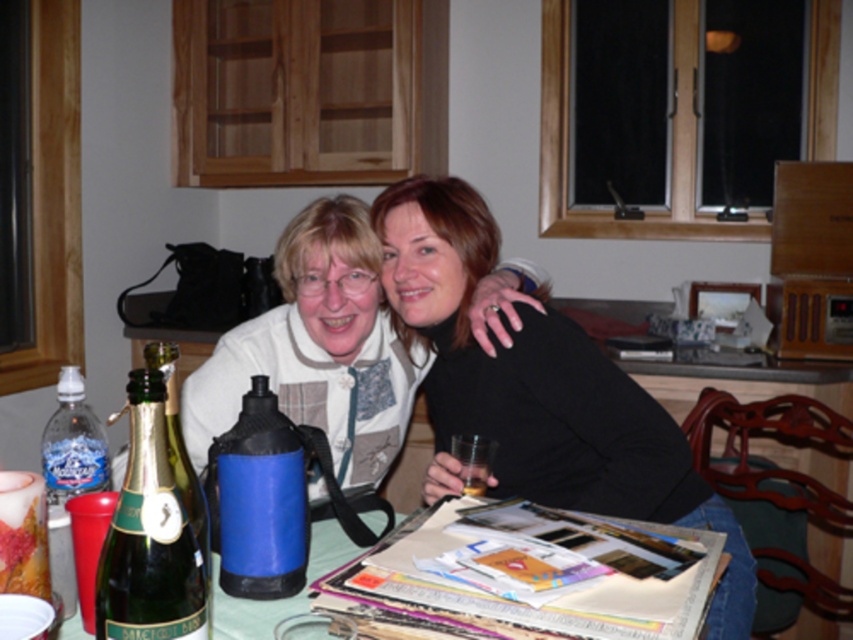
Between printed paper magazine at table center and blue matte water bottle at center, which one is positioned higher?

blue matte water bottle at center is above.

Does printed paper magazine at table center have a smaller size compared to blue matte water bottle at center?

No, printed paper magazine at table center is not smaller than blue matte water bottle at center.

The image size is (853, 640). What are the coordinates of `printed paper magazine at table center` in the screenshot? It's located at coord(526,604).

Can you confirm if green glass bottle at lower left is bigger than transparent glass at center?

Indeed, green glass bottle at lower left has a larger size compared to transparent glass at center.

Is point (189, 604) closer to viewer compared to point (469, 492)?

Yes, point (189, 604) is in front of point (469, 492).

In order to click on green glass bottle at lower left in this screenshot , I will do `click(149, 536)`.

This screenshot has height=640, width=853. What do you see at coordinates (538, 392) in the screenshot?
I see `black matte sweater at center` at bounding box center [538, 392].

How far apart are black matte sweater at center and printed paper magazine at table center?

The distance of black matte sweater at center from printed paper magazine at table center is 36.93 centimeters.

The width and height of the screenshot is (853, 640). What do you see at coordinates (538, 392) in the screenshot?
I see `black matte sweater at center` at bounding box center [538, 392].

Image resolution: width=853 pixels, height=640 pixels. Identify the location of black matte sweater at center. (538, 392).